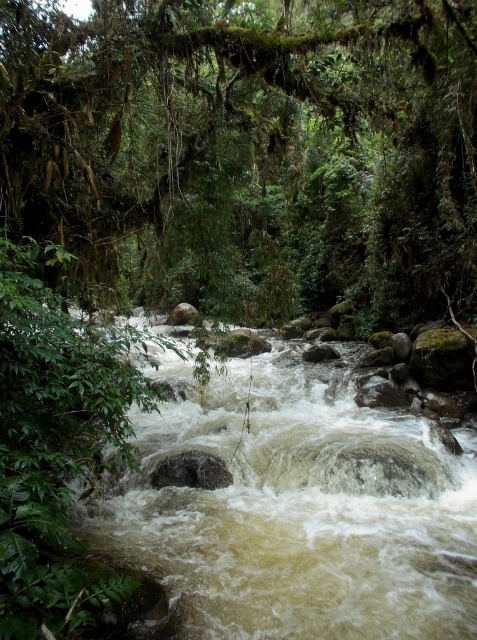
You are a hiker trying to cross the river using a fallen log. You see the green mossy tree at center and the white frothy water at center. Which object is closer to you as you stand on the log?

The green mossy tree at center is closer to you because the white frothy water at center is behind it.

You are a hiker trying to cross the river using a fallen tree trunk. You observe the green mossy tree at center and the white frothy water at center. Which object is taller and could potentially provide a better vantage point for assessing the river crossing?

The green mossy tree at center is taller than the white frothy water at center, so it could provide a better vantage point for assessing the river crossing.

You are a hiker in the forest and want to find the green mossy tree at center. According to the map coordinates, you are currently at point (248,148). Which direction should you move to reach the green mossy tree at center?

The point (248,148) marks the green mossy tree at center, so you are already at the location of the green mossy tree at center.